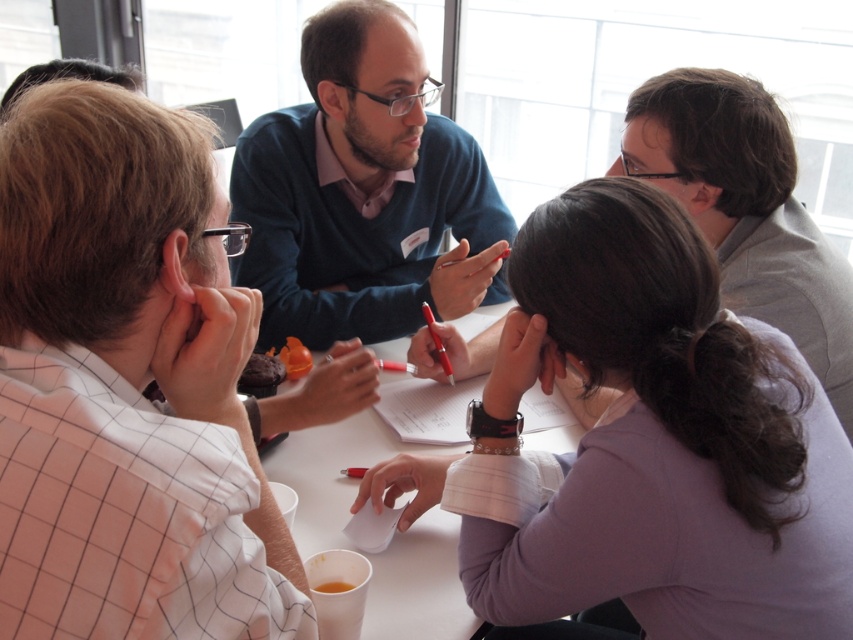
You are standing at the entrance of the conference room and see the point marked at coordinates (662, 445). What object or person is located at that point?

The point at coordinates (662, 445) corresponds to the purple fabric shirt at center.

You are organizing a small event and need to decide seating arrangements. There is a purple fabric shirt at center and a chocolate cake at lower center. Which object takes up more horizontal space in the image?

The purple fabric shirt at center takes up more horizontal space than the chocolate cake at lower center because its width is larger.

You are attending a meeting and need to present your idea. You are wearing the purple fabric shirt at center. The chocolate cake at lower center is on the table. Where should you stand to ensure that your shirt is visible to everyone around the table?

You should stand above the chocolate cake at lower center because the purple fabric shirt at center is located below it, so moving above would place the shirt in a more visible position relative to the table.